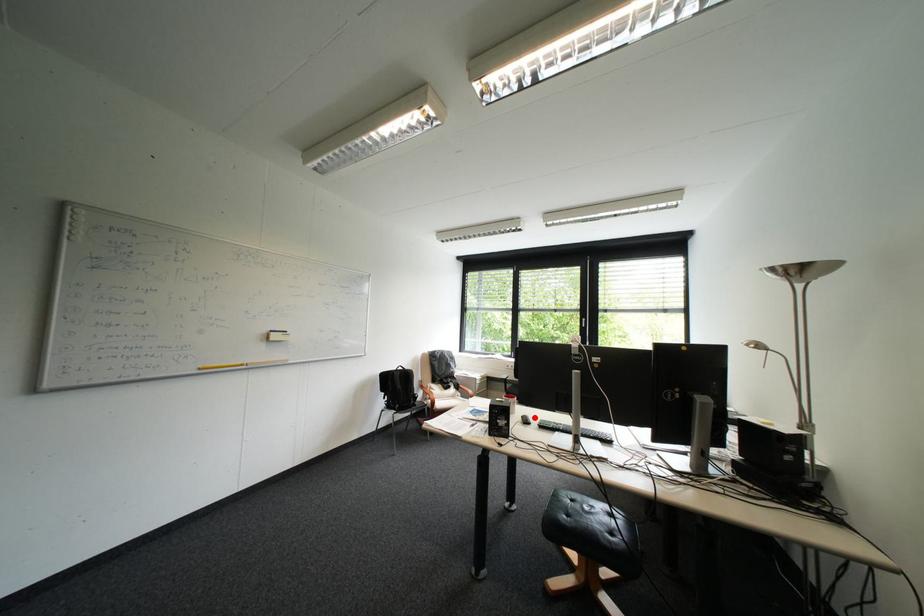
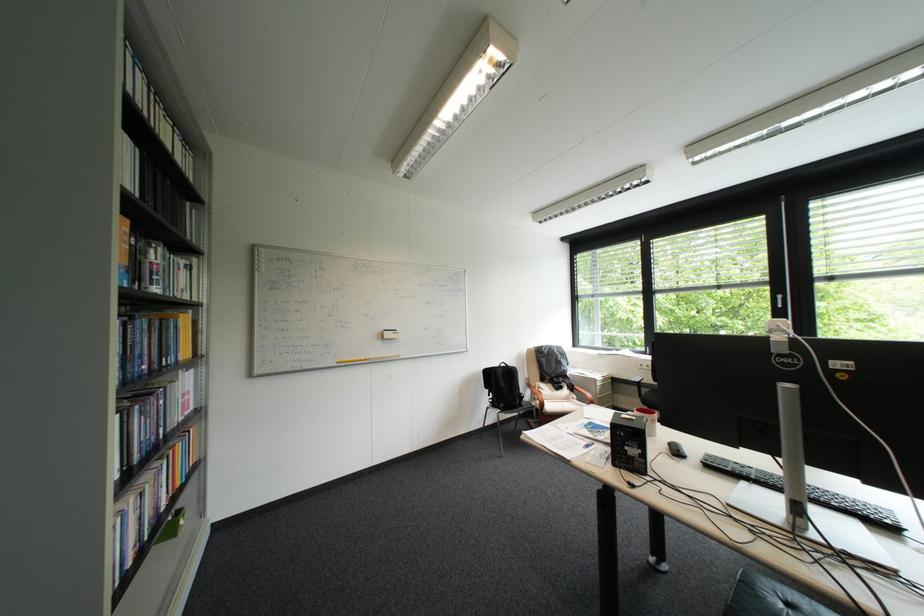
The point at the highlighted location is marked in the first image. Where is the corresponding point in the second image?

(682, 445)